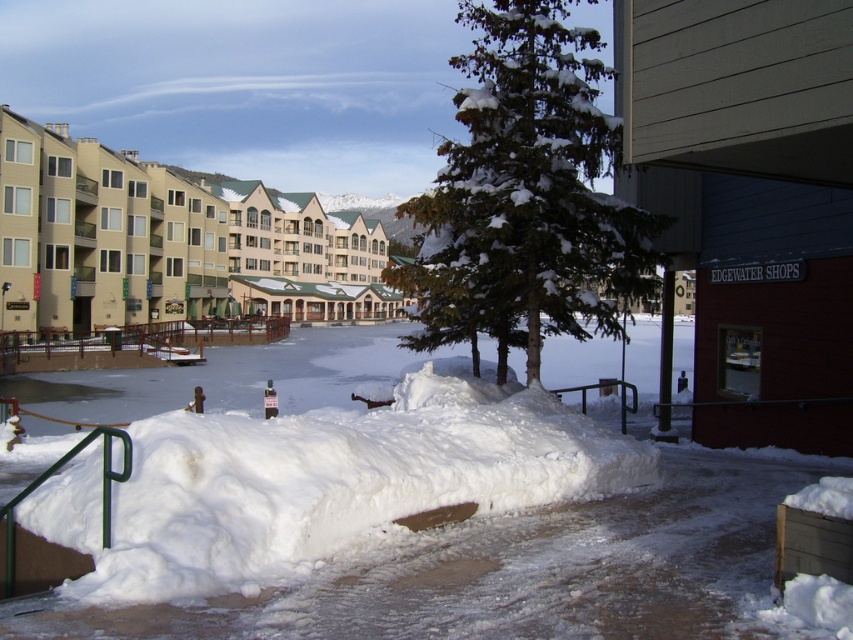
Can you confirm if white fluffy snow at center is smaller than beige/matte building at upper left?

Yes.

Between white fluffy snow at center and beige/matte building at upper left, which one appears on the left side from the viewer's perspective?

beige/matte building at upper left is more to the left.

Is point (451, 365) in front of point (119, 308)?

Yes.

Image resolution: width=853 pixels, height=640 pixels. I want to click on white fluffy snow at center, so (x=320, y=483).